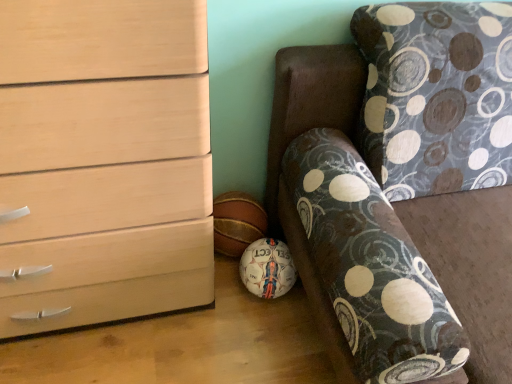
Question: Should I look upward or downward to see patterned fabric couch at lower right?

Choices:
 (A) down
 (B) up

Answer: (A)

Question: Is patterned fabric couch at lower right a part of matte wood chest of drawers at left?

Choices:
 (A) yes
 (B) no

Answer: (B)

Question: From a real-world perspective, is matte wood chest of drawers at left over patterned fabric couch at lower right?

Choices:
 (A) yes
 (B) no

Answer: (A)

Question: Can you confirm if matte wood chest of drawers at left is thinner than patterned fabric couch at lower right?

Choices:
 (A) yes
 (B) no

Answer: (A)

Question: Can you confirm if matte wood chest of drawers at left is positioned to the left of patterned fabric couch at lower right?

Choices:
 (A) yes
 (B) no

Answer: (A)

Question: Does matte wood chest of drawers at left have a smaller size compared to patterned fabric couch at lower right?

Choices:
 (A) yes
 (B) no

Answer: (A)

Question: Is matte wood chest of drawers at left at the right side of patterned fabric couch at lower right?

Choices:
 (A) yes
 (B) no

Answer: (B)

Question: From the image's perspective, is patterned fabric couch at lower right on top of matte wood chest of drawers at left?

Choices:
 (A) yes
 (B) no

Answer: (B)

Question: From the image's perspective, would you say patterned fabric couch at lower right is shown under matte wood chest of drawers at left?

Choices:
 (A) yes
 (B) no

Answer: (A)

Question: Does patterned fabric couch at lower right come in front of matte wood chest of drawers at left?

Choices:
 (A) no
 (B) yes

Answer: (B)

Question: Considering the relative positions of patterned fabric couch at lower right and matte wood chest of drawers at left in the image provided, is patterned fabric couch at lower right to the left of matte wood chest of drawers at left from the viewer's perspective?

Choices:
 (A) yes
 (B) no

Answer: (B)

Question: Is patterned fabric couch at lower right positioned beyond the bounds of matte wood chest of drawers at left?

Choices:
 (A) yes
 (B) no

Answer: (A)

Question: Is patterned fabric couch at lower right with matte wood chest of drawers at left?

Choices:
 (A) yes
 (B) no

Answer: (B)

Question: Is patterned fabric couch at lower right inside the boundaries of matte wood chest of drawers at left, or outside?

Choices:
 (A) inside
 (B) outside

Answer: (B)